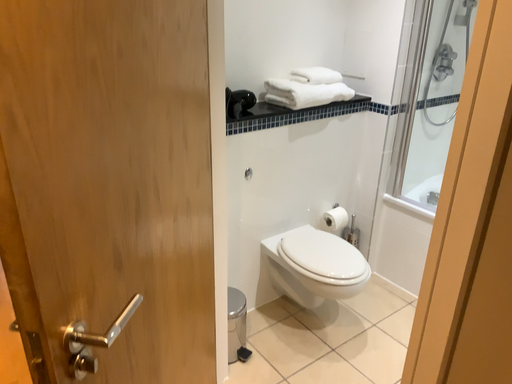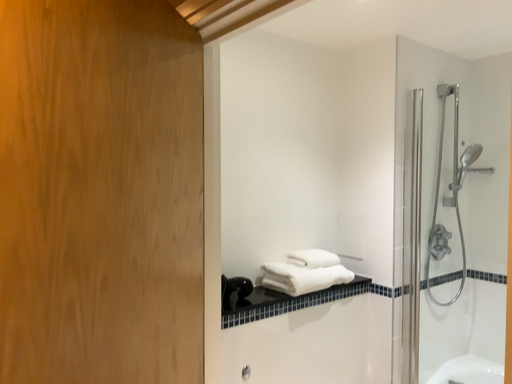
Question: How did the camera likely rotate when shooting the video?

Choices:
 (A) rotated downward
 (B) rotated upward

Answer: (B)